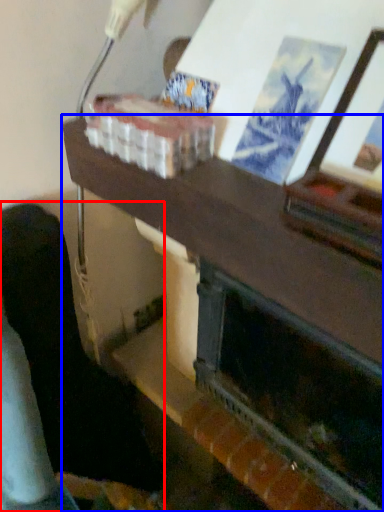
Question: Among these objects, which one is farthest to the camera, furniture (highlighted by a red box) or table (highlighted by a blue box)?

Choices:
 (A) furniture
 (B) table

Answer: (A)